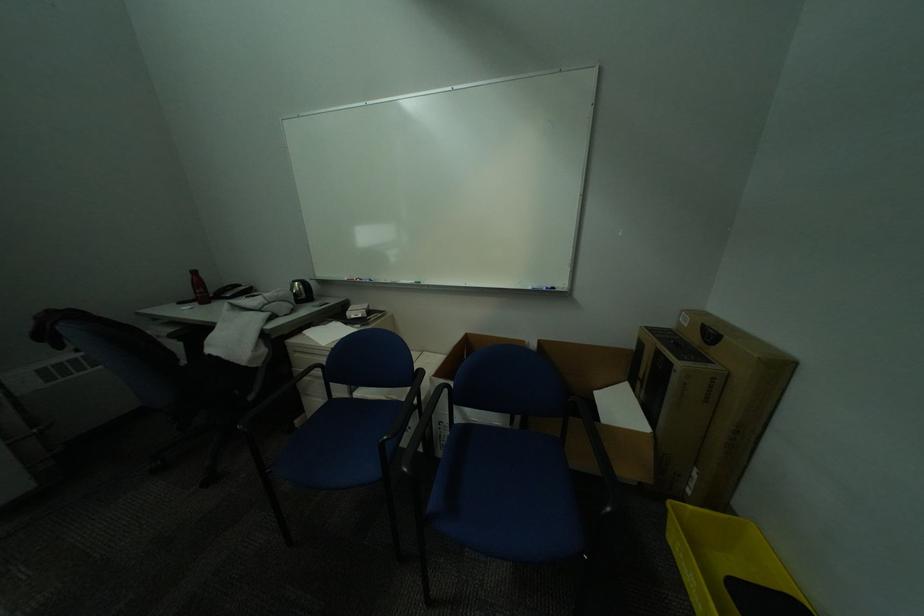
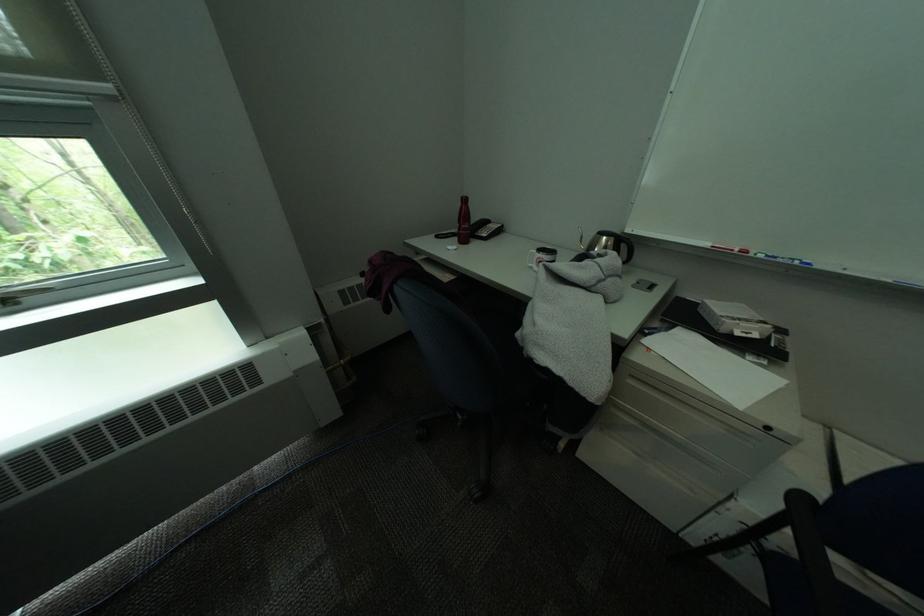
Find the pixel in the second image that matches point (208, 304) in the first image.

(466, 241)